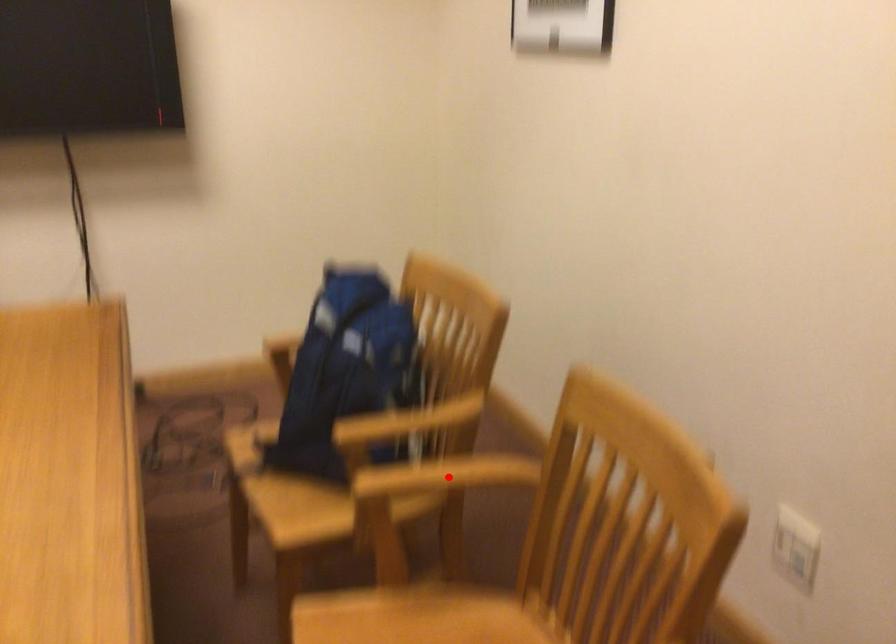
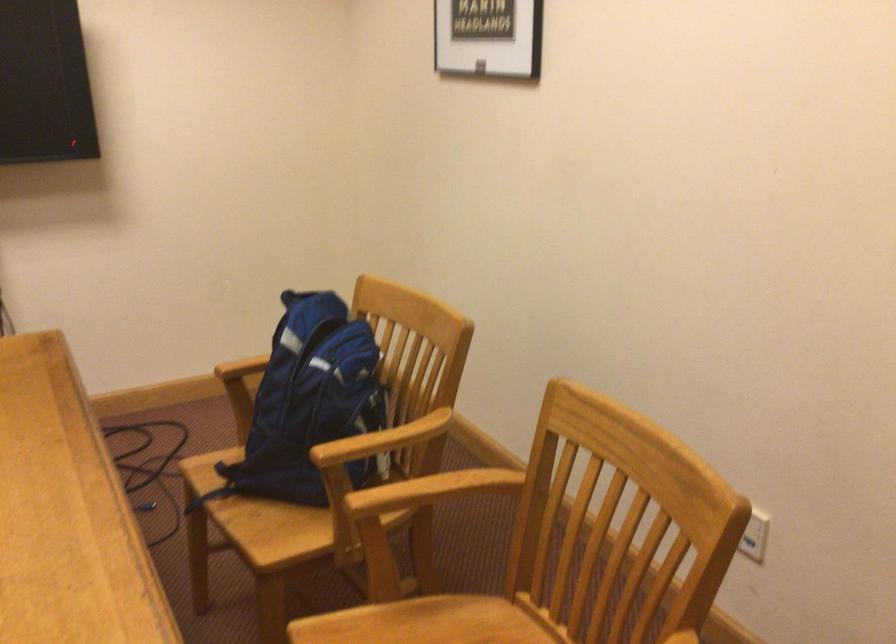
The point at the highlighted location is marked in the first image. Where is the corresponding point in the second image?

(436, 488)